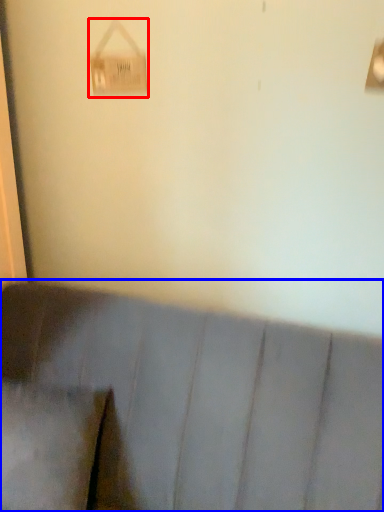
Question: Which object appears closest to the camera in this image, lamp (highlighted by a red box) or furniture (highlighted by a blue box)?

Choices:
 (A) lamp
 (B) furniture

Answer: (B)